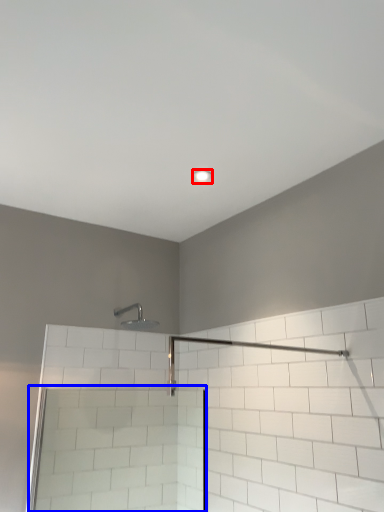
Question: Which object is closer to the camera taking this photo, light fixture (highlighted by a red box) or screen door (highlighted by a blue box)?

Choices:
 (A) light fixture
 (B) screen door

Answer: (B)